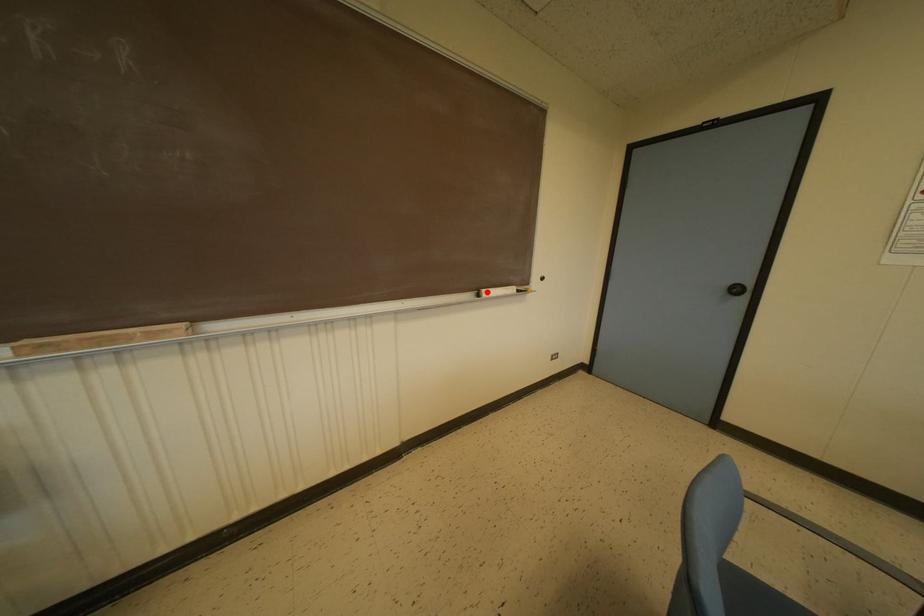
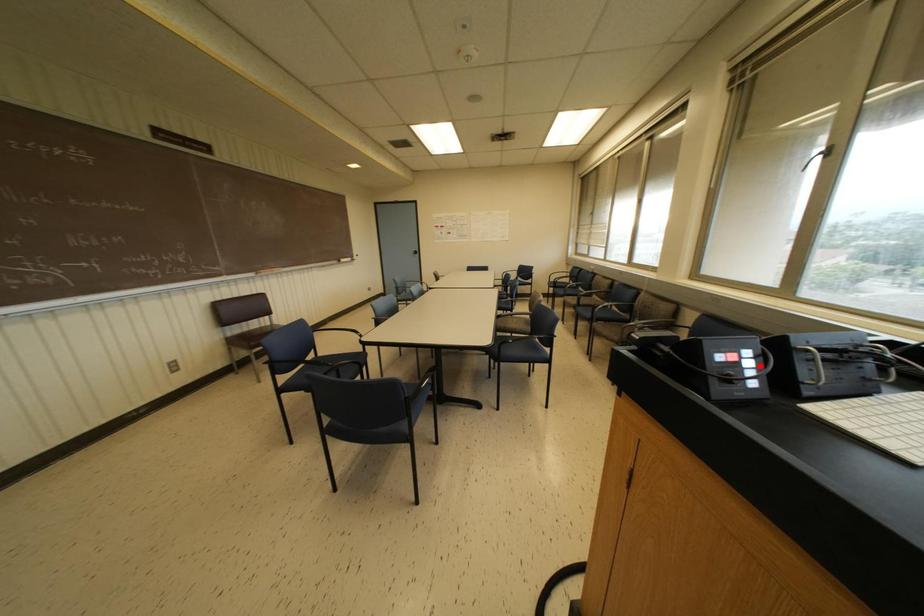
I am providing you with two images of the same scene from different viewpoints. A red point is marked on the first image and another point is marked on the second image. Is the red point in image1 aligned with the point shown in image2?

No